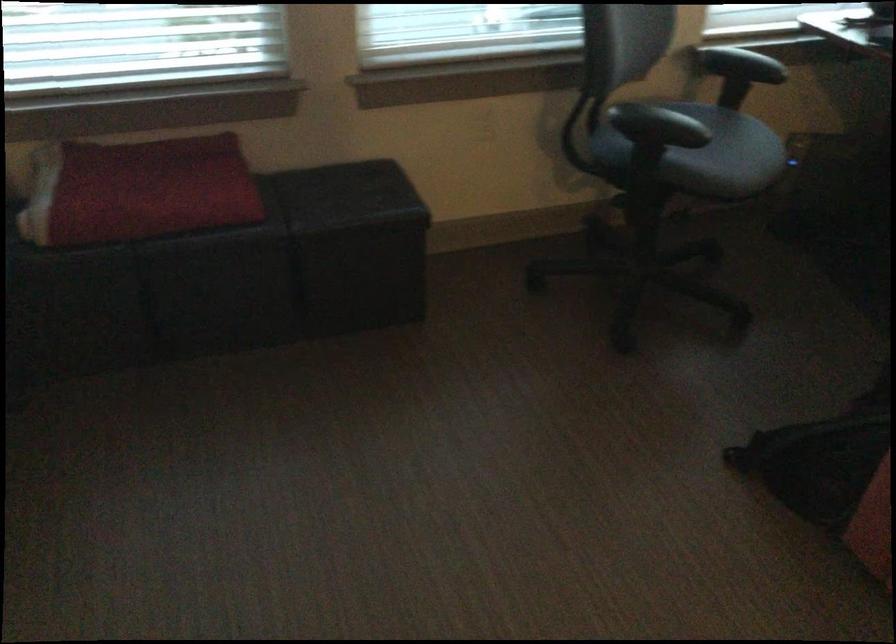
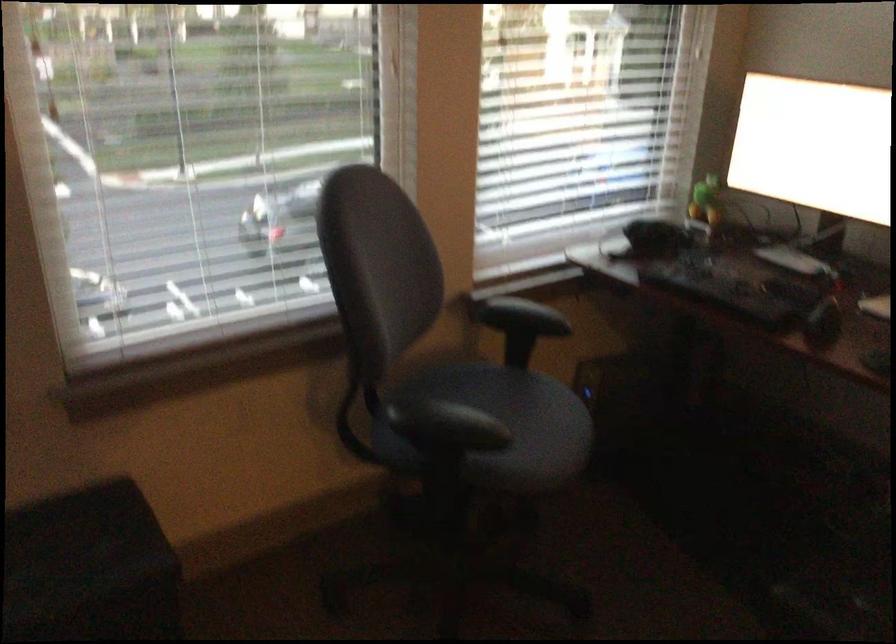
In the second image, find the point that corresponds to point (741, 125) in the first image.

(533, 404)